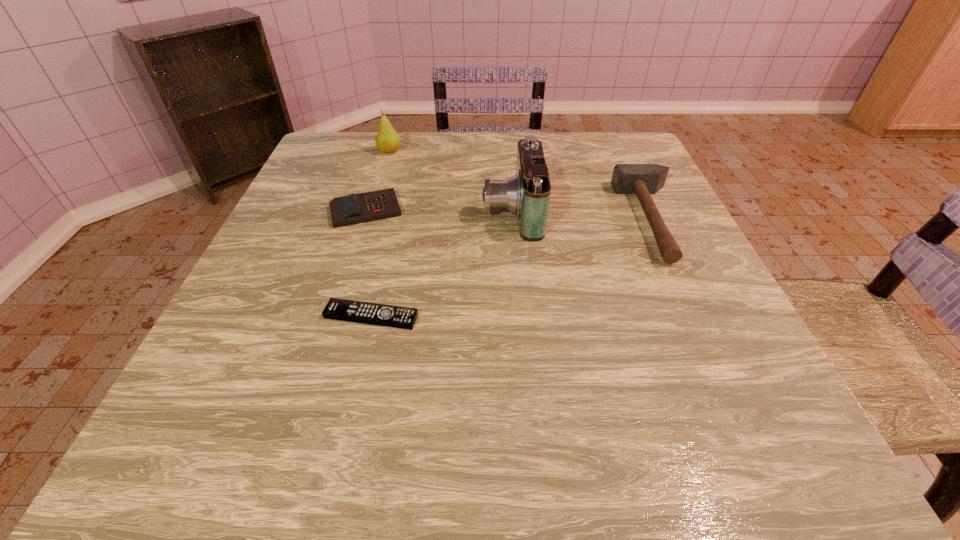
You are a GUI agent. You are given a task and a screenshot of the screen. Output one action in this format:
    pyautogui.click(x=<x>, y=<y>)
    Task: Click on the vacant space that is in between the second shortest object and the pear
    This screenshot has height=540, width=960.
    Given the screenshot: What is the action you would take?
    pyautogui.click(x=378, y=181)

This screenshot has width=960, height=540. What are the coordinates of `free space between the pear and the camcorder` in the screenshot? It's located at coord(450,181).

The height and width of the screenshot is (540, 960). I want to click on free space that is in between the calculator and the hammer, so click(510, 215).

What are the coordinates of `vacant point located between the pear and the second object from right to left` in the screenshot? It's located at (450, 181).

Identify which object is located as the nearest to the second shortest object. Please provide its 2D coordinates. Your answer should be formatted as a tuple, i.e. [(x, y)], where the tuple contains the x and y coordinates of a point satisfying the conditions above.

[(387, 140)]

At what (x,y) coordinates should I click in order to perform the action: click on object that is the closest to the second shortest object. Please return your answer as a coordinate pair (x, y). Looking at the image, I should click on (387, 140).

The width and height of the screenshot is (960, 540). In order to click on free space that satisfies the following two spatial constraints: 1. on the front side of the second shortest object; 2. on the left side of the shortest object in this screenshot , I will do `click(333, 316)`.

You are a GUI agent. You are given a task and a screenshot of the screen. Output one action in this format:
    pyautogui.click(x=<x>, y=<y>)
    Task: Click on the vacant position in the image that satisfies the following two spatial constraints: 1. on the back side of the farthest object; 2. on the left side of the fourth tallest object
    The width and height of the screenshot is (960, 540).
    Given the screenshot: What is the action you would take?
    pyautogui.click(x=385, y=152)